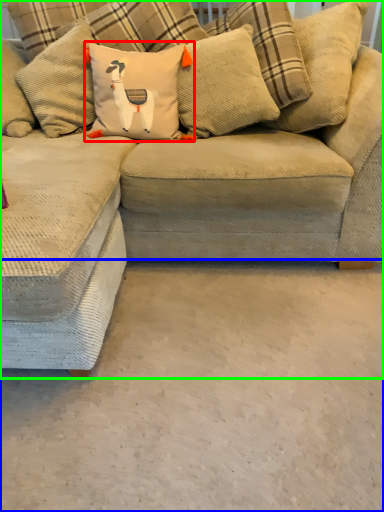
Question: Which object is positioned farthest from pillow (highlighted by a red box)? Select from concrete (highlighted by a blue box) and studio couch (highlighted by a green box).

Choices:
 (A) concrete
 (B) studio couch

Answer: (A)